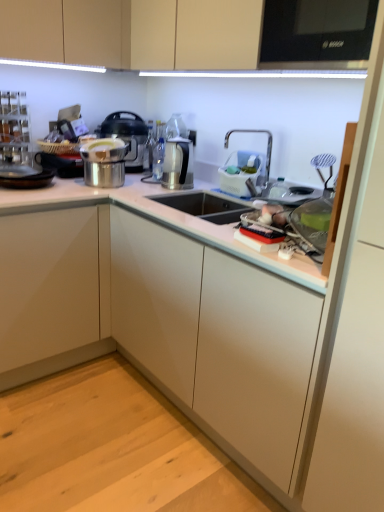
Question: From a real-world perspective, relative to white plastic dish rack at upper right, acting as the 1th appliance starting from the right, is white plastic sink at upper right vertically above or below?

Choices:
 (A) below
 (B) above

Answer: (B)

Question: Looking at the image, does white plastic sink at upper right seem bigger or smaller compared to white plastic dish rack at upper right, acting as the 1th appliance starting from the right?

Choices:
 (A) small
 (B) big

Answer: (B)

Question: Which object is positioned closest to the satin silver kettle at center, the 2th appliance positioned from the right?

Choices:
 (A) matte beige cabinets at upper center, the second cabinetry when ordered from left to right
 (B) black glossy microwave at upper right
 (C) white plastic sink at upper right
 (D) white glossy cabinet at lower left, positioned as the first cabinetry in bottom-to-top order
 (E) white plastic dish rack at upper right, which ranks as the 2th appliance in left-to-right order

Answer: (E)

Question: Which is nearer to the stainless steel pot at center?

Choices:
 (A) white glossy cabinet at lower left, which is counted as the 2th cabinetry, starting from the right
 (B) white plastic dish rack at upper right, acting as the 1th appliance starting from the right
 (C) white plastic sink at upper right
 (D) black glossy microwave at upper right
 (E) satin silver kettle at center, the 2th appliance positioned from the right

Answer: (E)